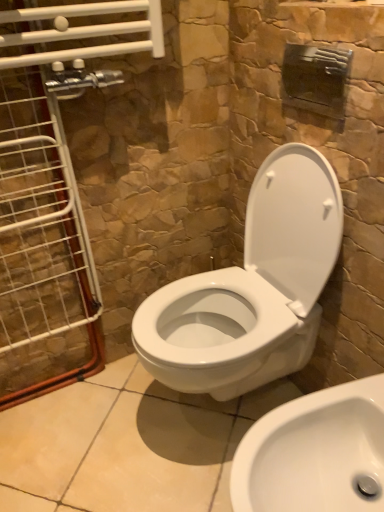
Question: Does white glossy toilet at center appear on the right side of white glossy sink at lower right?

Choices:
 (A) no
 (B) yes

Answer: (A)

Question: From a real-world perspective, is white glossy toilet at center positioned under white glossy sink at lower right based on gravity?

Choices:
 (A) yes
 (B) no

Answer: (B)

Question: Does white glossy toilet at center have a larger size compared to white glossy sink at lower right?

Choices:
 (A) yes
 (B) no

Answer: (A)

Question: Could you tell me if white glossy toilet at center is turned towards white glossy sink at lower right?

Choices:
 (A) yes
 (B) no

Answer: (B)

Question: Is white glossy toilet at center not within white glossy sink at lower right?

Choices:
 (A) no
 (B) yes

Answer: (B)

Question: Based on their sizes in the image, would you say white glossy sink at lower right is bigger or smaller than clear glass door at left?

Choices:
 (A) small
 (B) big

Answer: (B)

Question: From a real-world perspective, is white glossy sink at lower right above or below clear glass door at left?

Choices:
 (A) below
 (B) above

Answer: (A)

Question: Relative to clear glass door at left, is white glossy sink at lower right in front or behind?

Choices:
 (A) front
 (B) behind

Answer: (A)

Question: Is white glossy sink at lower right taller or shorter than clear glass door at left?

Choices:
 (A) short
 (B) tall

Answer: (A)

Question: From a real-world perspective, is white glossy sink at lower right positioned above or below white glossy toilet at center?

Choices:
 (A) below
 (B) above

Answer: (A)

Question: Does point (317, 409) appear closer or farther from the camera than point (286, 154)?

Choices:
 (A) farther
 (B) closer

Answer: (B)

Question: From the image's perspective, is white glossy sink at lower right above or below white glossy toilet at center?

Choices:
 (A) below
 (B) above

Answer: (A)

Question: In the image, is white glossy sink at lower right positioned in front of or behind white glossy toilet at center?

Choices:
 (A) behind
 (B) front

Answer: (B)

Question: From a real-world perspective, is clear glass door at left physically located above or below white glossy sink at lower right?

Choices:
 (A) above
 (B) below

Answer: (A)

Question: Based on their sizes in the image, would you say clear glass door at left is bigger or smaller than white glossy sink at lower right?

Choices:
 (A) small
 (B) big

Answer: (A)